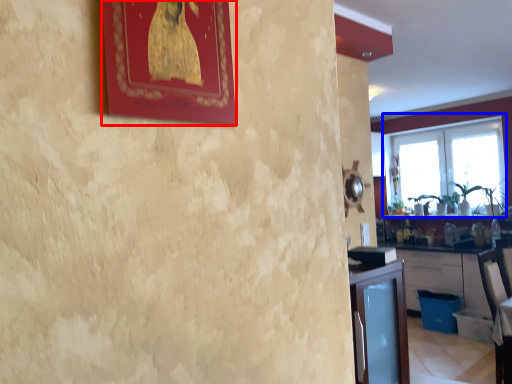
Question: Which object is further to the camera taking this photo, picture frame (highlighted by a red box) or window (highlighted by a blue box)?

Choices:
 (A) picture frame
 (B) window

Answer: (B)